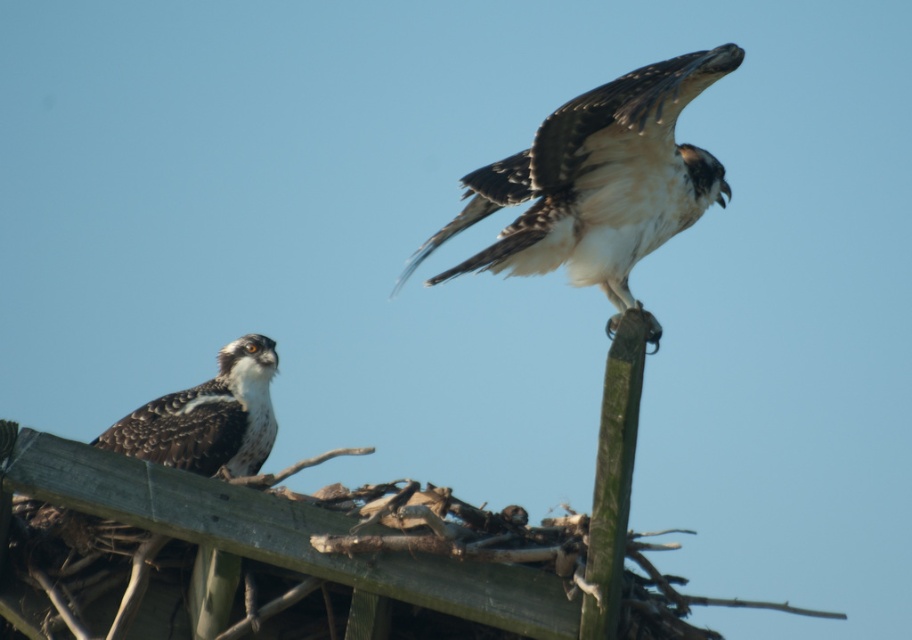
You are an ornithologist observing two ospreys on a wooden structure. You notice a point marked at coordinates (600, 180). Which osprey does this point correspond to, the one on the left or the one on the right?

The point marked at coordinates (600, 180) corresponds to the osprey on the right, as it marks the white and brown feathers at the upper right part of the image.